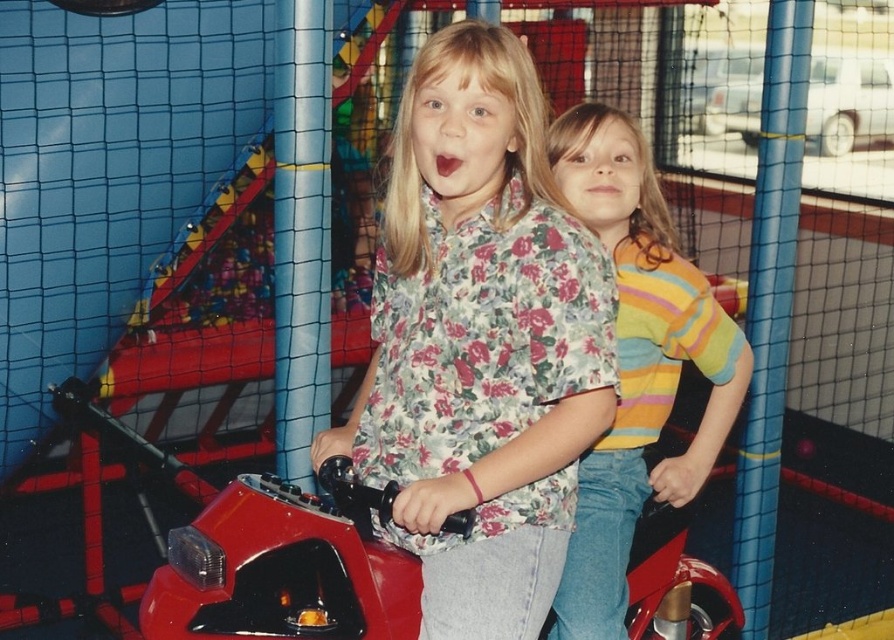
You are a photographer trying to capture a photo of both children wearing the floral print shirt at center and the striped cotton shirt at center. Since they are both at the center, how can you ensure both shirts are visible in the photo?

The floral print shirt at center is in front of the striped cotton shirt at center, so you should position the camera slightly behind the striped cotton shirt at center to ensure both shirts are visible.

You are a parent trying to decide whether to let your child wear the striped cotton shirt at center over the shiny red motorcycle at center. Based on their sizes, which one should be easier to put on?

The striped cotton shirt at center is much taller than the shiny red motorcycle at center, so it might be easier to put on the shiny red motorcycle at center first since it is shorter.